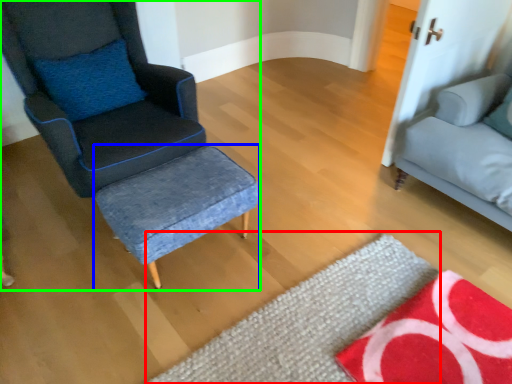
Question: Based on their relative distances, which object is farther from mat (highlighted by a red box)? Choose from stool (highlighted by a blue box) and chair (highlighted by a green box).

Choices:
 (A) stool
 (B) chair

Answer: (B)